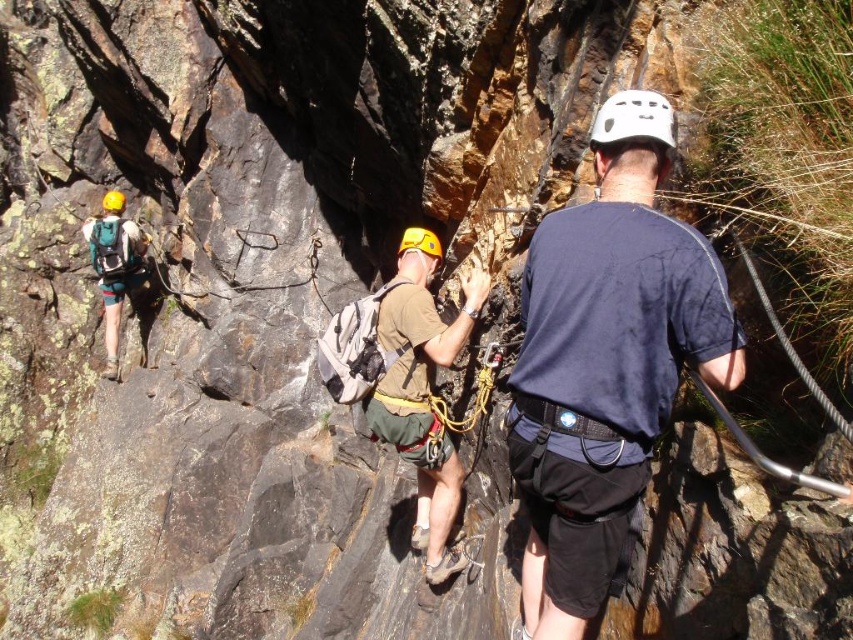
You are a climber trying to reach the top of the cliff. You see two points marked on the rock face. The first point is at coordinate point (532, 387) and the second point is at coordinate point (383, 380). Which point should you grab first if you want to move upward?

You should grab point (532, 387) first because it is in front of point (383, 380), allowing you to ascend more effectively.